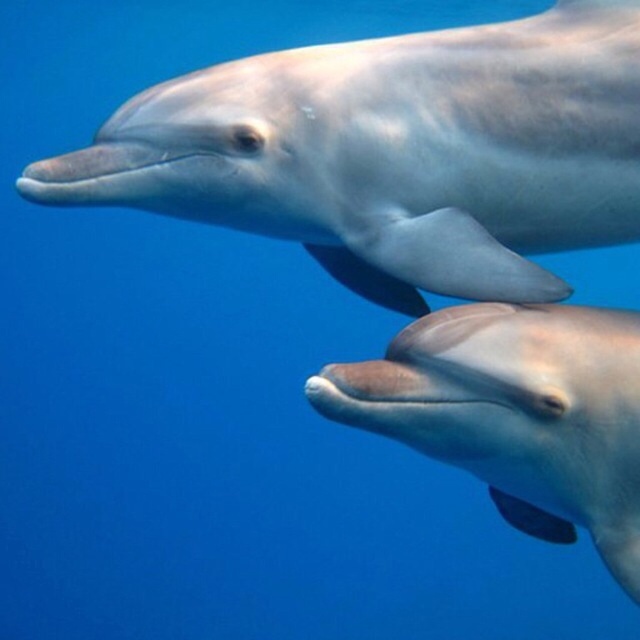
You are a marine biologist observing two dolphins underwater. You notice a sleek silver dolphin at upper center and a smooth gray dolphin at center. Which dolphin is positioned more to the left?

The sleek silver dolphin at upper center is positioned more to the left compared to the smooth gray dolphin at center.

You are a marine biologist observing two points in the ocean. The first point is at coordinates point [570,104] and the second is at point [440,438]. Based on the scene description, which point is closer to the surface of the water?

Point [440,438] is closer to the surface of the water because it is in front of point [570,104], which means it is nearer to the observer and thus closer to the water surface.

In the scene shown: You are a marine biologist observing two dolphins underwater. You notice the sleek silver dolphin at upper center and the smooth gray dolphin at center. Which dolphin is taller?

The sleek silver dolphin at upper center is much taller than the smooth gray dolphin at center.